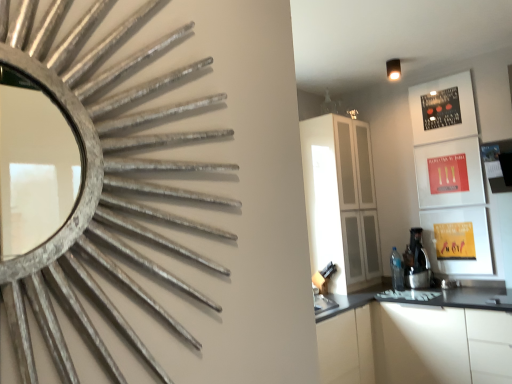
Question: Is white glossy cabinetry at lower right, the first cabinetry positioned from the bottom, facing towards satin black coffee machine at right?

Choices:
 (A) yes
 (B) no

Answer: (B)

Question: Does white glossy cabinetry at lower right, the second cabinetry from the top, have a lesser width compared to satin black coffee machine at right?

Choices:
 (A) no
 (B) yes

Answer: (A)

Question: Does white glossy cabinetry at lower right, the first cabinetry positioned from the bottom, have a larger size compared to satin black coffee machine at right?

Choices:
 (A) no
 (B) yes

Answer: (B)

Question: Considering the relative sizes of white glossy cabinetry at lower right, the second cabinetry from the top, and satin black coffee machine at right in the image provided, is white glossy cabinetry at lower right, the second cabinetry from the top, wider than satin black coffee machine at right?

Choices:
 (A) no
 (B) yes

Answer: (B)

Question: Is white glossy cabinetry at lower right, the second cabinetry from the top, facing away from satin black coffee machine at right?

Choices:
 (A) yes
 (B) no

Answer: (B)

Question: Visually, is satin black coffee machine at right positioned to the left or to the right of white glossy cabinetry at lower right, the second cabinetry from the top?

Choices:
 (A) left
 (B) right

Answer: (B)

Question: Considering the positions of point [409, 276] and point [376, 322], is point [409, 276] closer or farther from the camera than point [376, 322]?

Choices:
 (A) farther
 (B) closer

Answer: (A)

Question: In the image, is satin black coffee machine at right positioned in front of or behind white glossy cabinetry at lower right, the second cabinetry from the top?

Choices:
 (A) behind
 (B) front

Answer: (A)

Question: From a real-world perspective, is satin black coffee machine at right physically located above or below white glossy cabinetry at lower right, the second cabinetry from the top?

Choices:
 (A) below
 (B) above

Answer: (B)

Question: In the image, is white glossy cabinetry at lower right, the first cabinetry positioned from the bottom, positioned in front of or behind silver textured mirror at upper left?

Choices:
 (A) behind
 (B) front

Answer: (A)

Question: Do you think white glossy cabinetry at lower right, the first cabinetry positioned from the bottom, is within silver textured mirror at upper left, or outside of it?

Choices:
 (A) outside
 (B) inside

Answer: (A)

Question: In the image, is white glossy cabinetry at lower right, the second cabinetry from the top, on the left side or the right side of silver textured mirror at upper left?

Choices:
 (A) left
 (B) right

Answer: (B)

Question: Considering the positions of white glossy cabinetry at lower right, the first cabinetry positioned from the bottom, and silver textured mirror at upper left in the image, is white glossy cabinetry at lower right, the first cabinetry positioned from the bottom, bigger or smaller than silver textured mirror at upper left?

Choices:
 (A) small
 (B) big

Answer: (B)

Question: From the image's perspective, is satin black coffee machine at right positioned above or below white glossy cabinet at center, which is the first cabinetry in top-to-bottom order?

Choices:
 (A) above
 (B) below

Answer: (B)

Question: Is point (x=415, y=261) positioned closer to the camera than point (x=316, y=185)?

Choices:
 (A) closer
 (B) farther

Answer: (B)